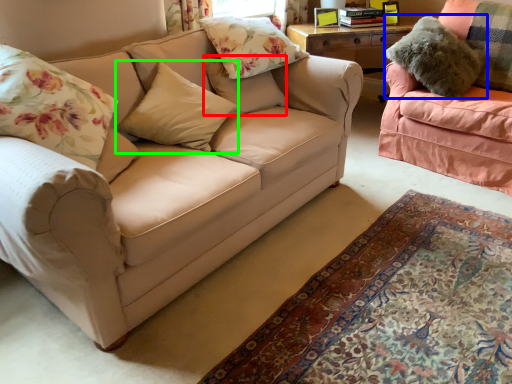
Question: Estimate the real-world distances between objects in this image. Which object is closer to pillow (highlighted by a red box), pillow (highlighted by a blue box) or pillow (highlighted by a green box)?

Choices:
 (A) pillow
 (B) pillow

Answer: (B)